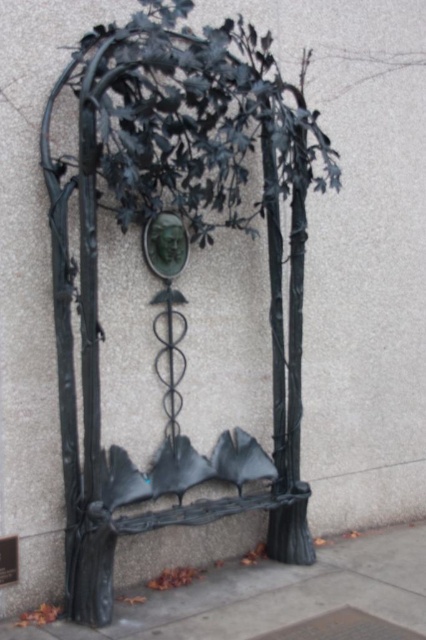
Can you confirm if smooth concrete pavement at lower center is positioned above green patina mask at center?

No.

Which of these two, smooth concrete pavement at lower center or green patina mask at center, stands shorter?

Standing shorter between the two is smooth concrete pavement at lower center.

Does point (63, 627) come closer to viewer compared to point (143, 237)?

Yes.

Image resolution: width=426 pixels, height=640 pixels. In order to click on smooth concrete pavement at lower center in this screenshot , I will do `click(273, 595)`.

Is point (161, 252) positioned before point (2, 570)?

No, it is not.

In the scene shown: Can you confirm if green patina mask at center is positioned to the left of black matte plaque at lower left?

In fact, green patina mask at center is to the right of black matte plaque at lower left.

Is point (170, 220) positioned before point (2, 582)?

No, (170, 220) is behind (2, 582).

Image resolution: width=426 pixels, height=640 pixels. Identify the location of green patina mask at center. (164, 244).

In the scene shown: Can you confirm if black wrought iron tree at center is thinner than smooth concrete pavement at lower center?

Indeed, black wrought iron tree at center has a lesser width compared to smooth concrete pavement at lower center.

Is black wrought iron tree at center wider than smooth concrete pavement at lower center?

No, black wrought iron tree at center is not wider than smooth concrete pavement at lower center.

Identify the location of black wrought iron tree at center. (x=173, y=276).

Find the location of a particular element. Image resolution: width=426 pixels, height=640 pixels. black wrought iron tree at center is located at coordinates (173, 276).